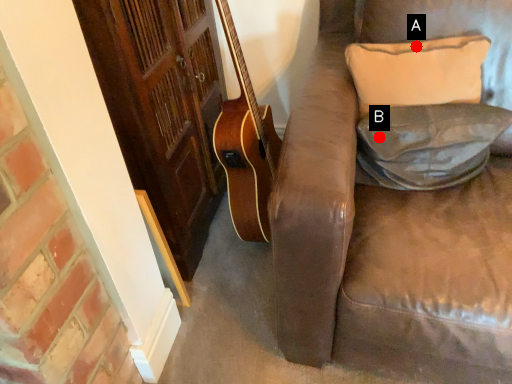
Question: Two points are circled on the image, labeled by A and B beside each circle. Which point is further to the camera?

Choices:
 (A) A is further
 (B) B is further

Answer: (A)